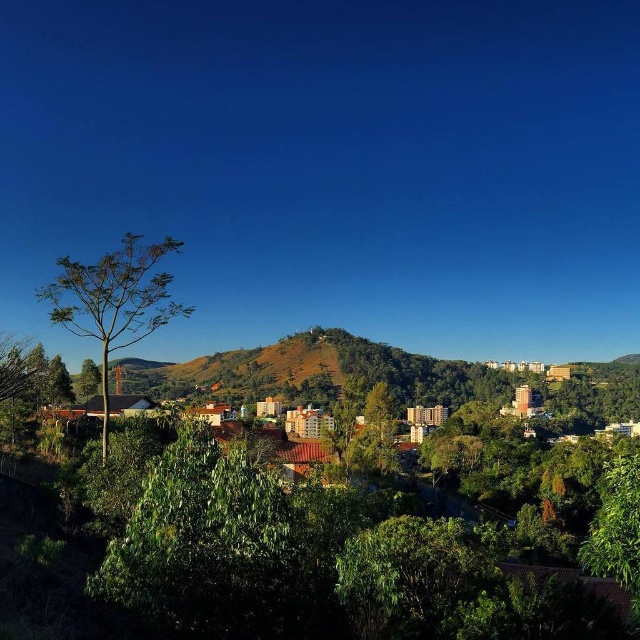
Question: Can you confirm if green glossy tree at center is positioned above green leafy tree at left?

Choices:
 (A) yes
 (B) no

Answer: (B)

Question: Is green glossy tree at center in front of green leafy tree at left?

Choices:
 (A) no
 (B) yes

Answer: (B)

Question: Can you confirm if green glossy tree at center is thinner than green leafy tree at lower right?

Choices:
 (A) yes
 (B) no

Answer: (A)

Question: Among these objects, which one is farthest from the camera?

Choices:
 (A) green glossy tree at center
 (B) green leafy tree at left

Answer: (B)

Question: Based on their relative distances, which object is nearer to the green glossy tree at center?

Choices:
 (A) green leafy tree at lower right
 (B) green leafy tree at left

Answer: (A)

Question: Among these objects, which one is nearest to the camera?

Choices:
 (A) green glossy tree at center
 (B) green leafy tree at left
 (C) green leafy tree at lower right

Answer: (C)